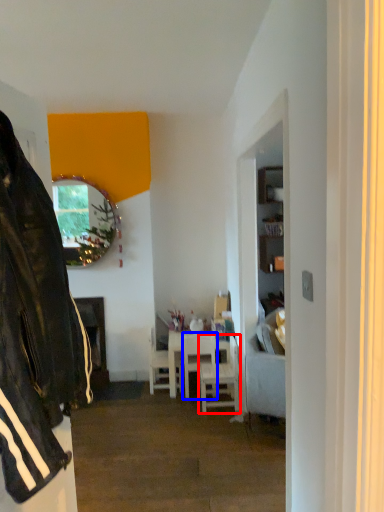
Question: Which point is further to the camera, chair (highlighted by a red box) or chair (highlighted by a blue box)?

Choices:
 (A) chair
 (B) chair

Answer: (B)